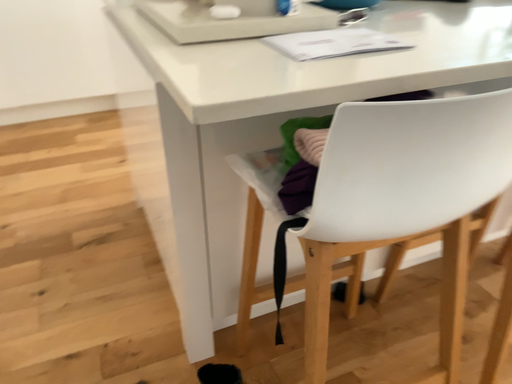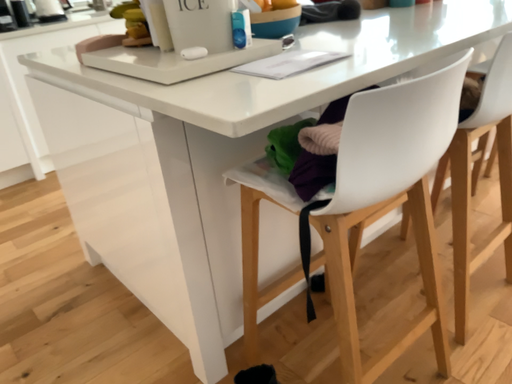
Question: Which way did the camera rotate in the video?

Choices:
 (A) rotated downward
 (B) rotated upward

Answer: (B)